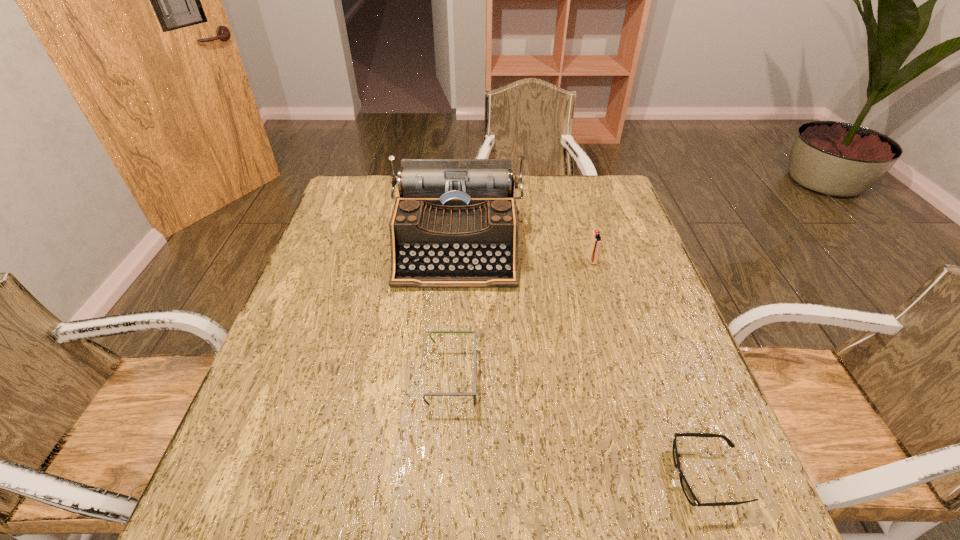
Where is `vacant space in between the third shortest object and the shortest object`? This screenshot has width=960, height=540. vacant space in between the third shortest object and the shortest object is located at coordinates (650, 369).

The width and height of the screenshot is (960, 540). In order to click on free space between the sunglasses and the tallest object in this screenshot , I will do `click(582, 361)`.

The height and width of the screenshot is (540, 960). I want to click on unoccupied area between the igniter and the typewriter, so click(524, 254).

Where is `object that is the third closest to the tallest object`? object that is the third closest to the tallest object is located at coordinates (686, 488).

Choose which object is the second nearest neighbor to the second object from right to left. Please provide its 2D coordinates. Your answer should be formatted as a tuple, i.e. [(x, y)], where the tuple contains the x and y coordinates of a point satisfying the conditions above.

[(473, 394)]

Find the location of `vacant region that satisfies the following two spatial constraints: 1. on the keyboard of the typewriter; 2. on the left side of the third object from left to right`. vacant region that satisfies the following two spatial constraints: 1. on the keyboard of the typewriter; 2. on the left side of the third object from left to right is located at coordinates (456, 261).